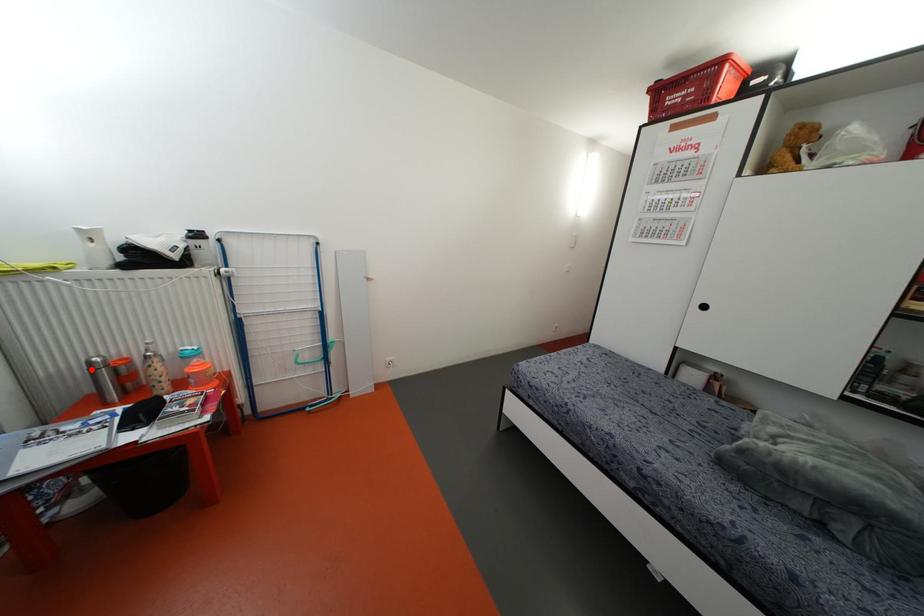
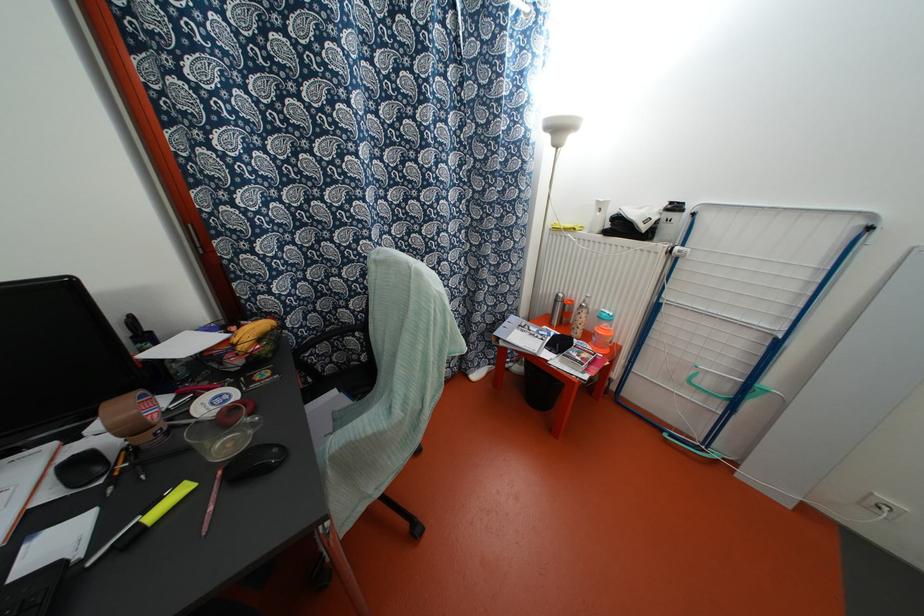
Question: I am providing you with two images of the same scene from different viewpoints. Image1 has a red point marked. In image2, the corresponding 3D location appears at what relative position? Reply with the corresponding letter.

Choices:
 (A) Closer
 (B) Farther

Answer: (A)